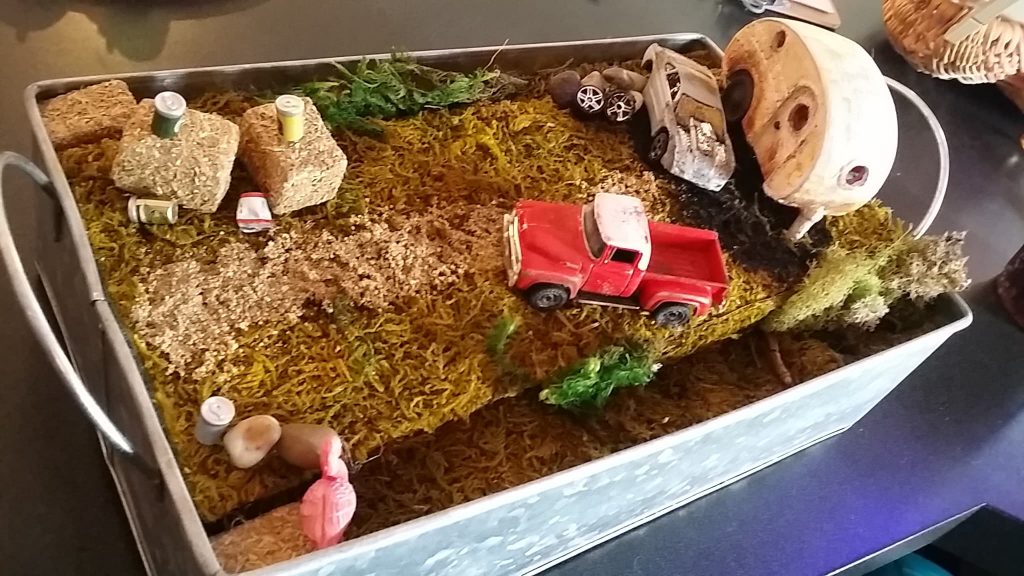
Find the location of a particular element. tray is located at coordinates (831, 395).